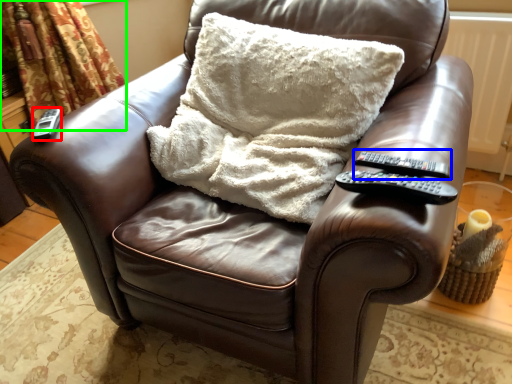
Question: Which object is positioned closest to remote (highlighted by a red box)? Select from remote (highlighted by a blue box) and curtain (highlighted by a green box).

Choices:
 (A) remote
 (B) curtain

Answer: (A)